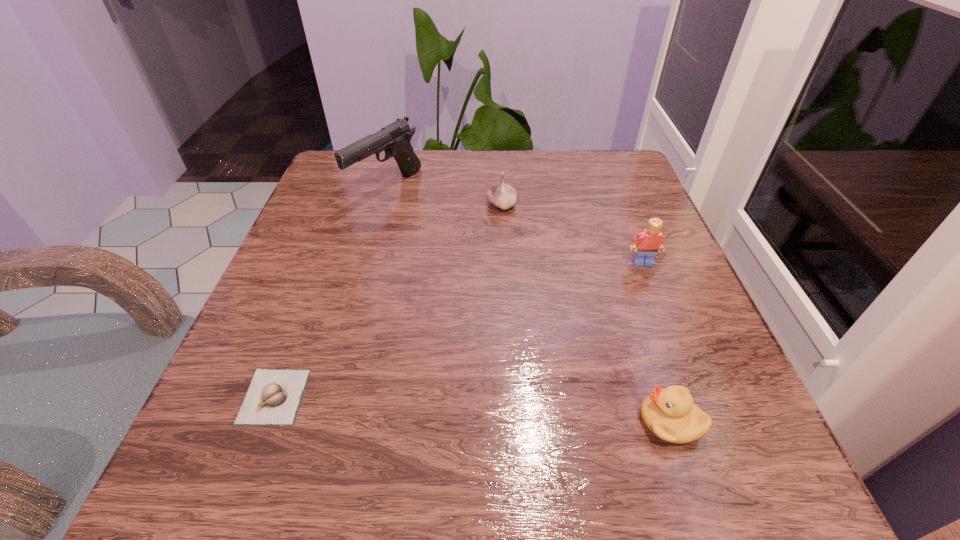
Identify the location of free location at the near right corner of the desktop. (692, 489).

Identify the location of free area in between the duckling and the taller garlic. (586, 313).

This screenshot has height=540, width=960. Identify the location of unoccupied position between the shorter garlic and the duckling. (472, 409).

You are a GUI agent. You are given a task and a screenshot of the screen. Output one action in this format:
    pyautogui.click(x=<x>, y=<y>)
    Task: Click on the unoccupied position between the duckling and the farther garlic
    This screenshot has height=540, width=960.
    Given the screenshot: What is the action you would take?
    pyautogui.click(x=586, y=313)

The height and width of the screenshot is (540, 960). In order to click on free area in between the gun and the second shortest object in this screenshot , I will do coord(528,305).

Find the location of `empty space between the right garlic and the left garlic`. empty space between the right garlic and the left garlic is located at coordinates (388, 301).

At what (x,y) coordinates should I click in order to perform the action: click on free spot between the fourth tallest object and the shorter garlic. Please return your answer as a coordinate pair (x, y). Image resolution: width=960 pixels, height=540 pixels. Looking at the image, I should click on 472,409.

I want to click on vacant space that's between the gun and the nearer garlic, so click(330, 292).

Locate an element on the screen. Image resolution: width=960 pixels, height=540 pixels. empty location between the tallest object and the second shortest object is located at coordinates (528, 305).

This screenshot has width=960, height=540. I want to click on unoccupied position between the left garlic and the third farthest object, so click(x=458, y=329).